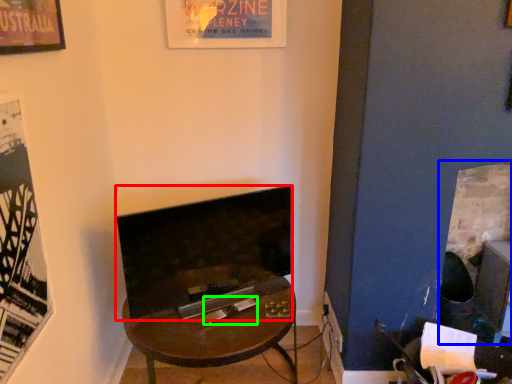
Question: Based on their relative distances, which object is nearer to fireplace (highlighted by a red box)? Choose from fireplace (highlighted by a blue box) and magazine (highlighted by a green box).

Choices:
 (A) fireplace
 (B) magazine

Answer: (B)